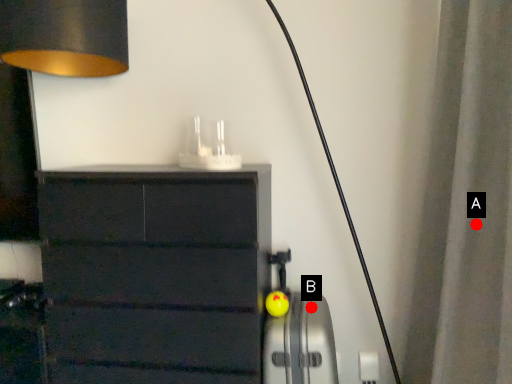
Question: Two points are circled on the image, labeled by A and B beside each circle. Which of the following is the closest to the observer?

Choices:
 (A) A is closer
 (B) B is closer

Answer: (A)